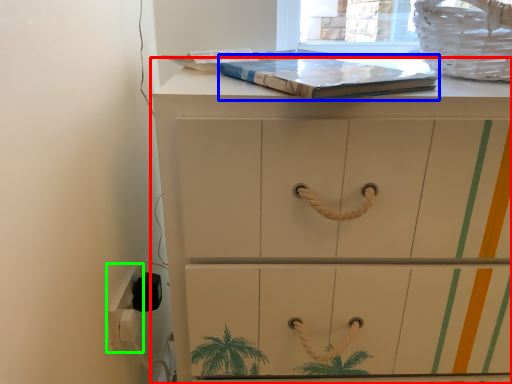
Question: Which object is the closest to the chest of drawers (highlighted by a red box)? Choose among these: paperback book (highlighted by a blue box) or electric outlet (highlighted by a green box).

Choices:
 (A) paperback book
 (B) electric outlet

Answer: (A)